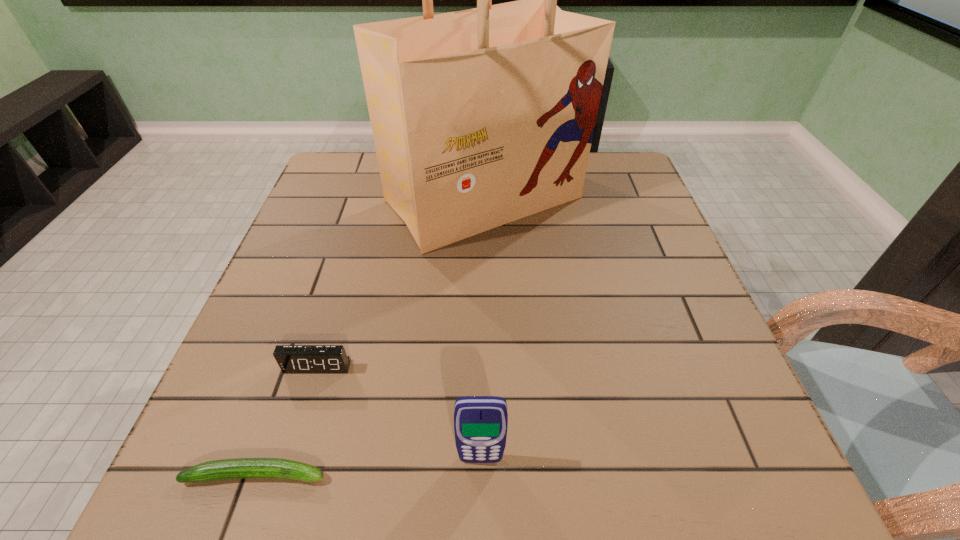
Where is `cellular telephone located at the near edge`? cellular telephone located at the near edge is located at coordinates (480, 422).

The image size is (960, 540). I want to click on zucchini that is at the near edge, so click(240, 468).

This screenshot has height=540, width=960. In order to click on alarm clock located at the left edge in this screenshot , I will do `click(291, 358)`.

Where is `zucchini present at the left edge`? zucchini present at the left edge is located at coordinates (240, 468).

The width and height of the screenshot is (960, 540). I want to click on object that is positioned at the near left corner, so click(x=240, y=468).

You are a GUI agent. You are given a task and a screenshot of the screen. Output one action in this format:
    pyautogui.click(x=<x>, y=<y>)
    Task: Click on the vacant space at the near edge
    The height and width of the screenshot is (540, 960).
    Given the screenshot: What is the action you would take?
    pyautogui.click(x=521, y=502)

At what (x,y) coordinates should I click in order to perform the action: click on vacant space at the left edge. Please return your answer as a coordinate pair (x, y). Looking at the image, I should click on (293, 296).

Find the location of `free space at the right edge`. free space at the right edge is located at coordinates (692, 305).

Where is `free space at the far left corner of the desktop`? The width and height of the screenshot is (960, 540). free space at the far left corner of the desktop is located at coordinates (371, 158).

Find the location of a particular element. Image resolution: width=960 pixels, height=540 pixels. vacant area at the near left corner of the desktop is located at coordinates (285, 453).